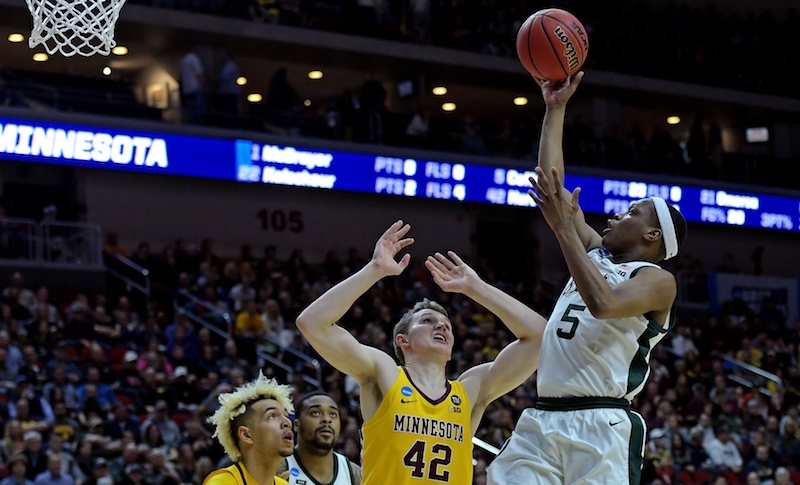
This screenshot has width=800, height=485. I want to click on fans, so click(102, 350).